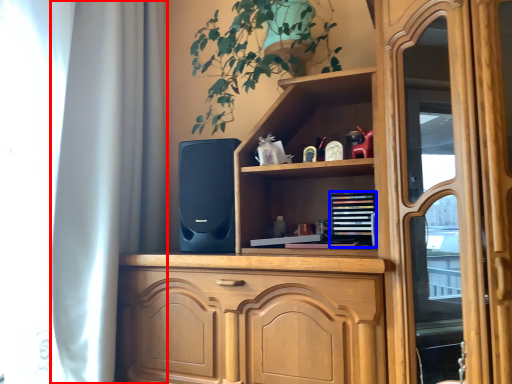
Question: Which object is closer to the camera taking this photo, curtain (highlighted by a red box) or book (highlighted by a blue box)?

Choices:
 (A) curtain
 (B) book

Answer: (A)